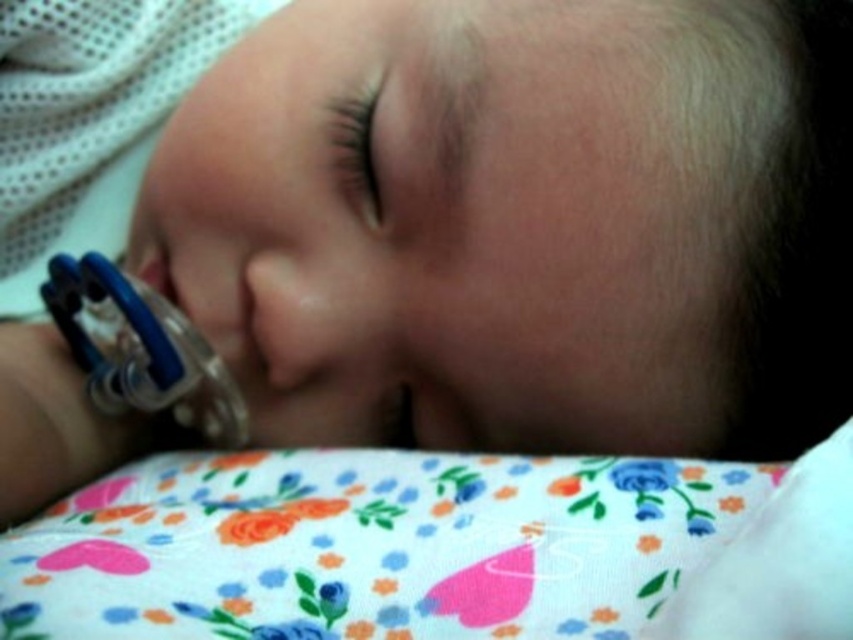
Can you confirm if floral fabric pillow at lower center is bigger than blue rubber teething ring at left?

Correct, floral fabric pillow at lower center is larger in size than blue rubber teething ring at left.

Based on the photo, does floral fabric pillow at lower center appear on the right side of blue rubber teething ring at left?

Yes, floral fabric pillow at lower center is to the right of blue rubber teething ring at left.

Describe the element at coordinates (370, 545) in the screenshot. I see `floral fabric pillow at lower center` at that location.

At what (x,y) coordinates should I click in order to perform the action: click on floral fabric pillow at lower center. Please return your answer as a coordinate pair (x, y). This screenshot has width=853, height=640. Looking at the image, I should click on (370, 545).